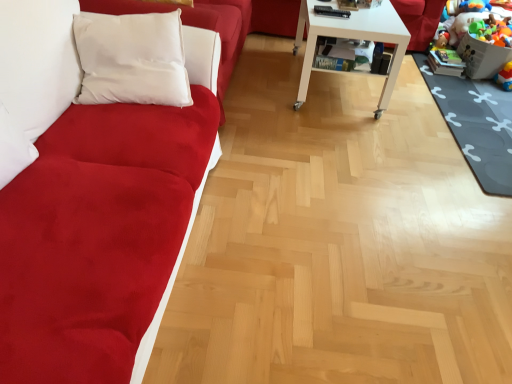
Where is `vacant area that is in front of plush multicolored toys at lower right, acting as the second toy starting from the bottom`? Image resolution: width=512 pixels, height=384 pixels. vacant area that is in front of plush multicolored toys at lower right, acting as the second toy starting from the bottom is located at coordinates (479, 90).